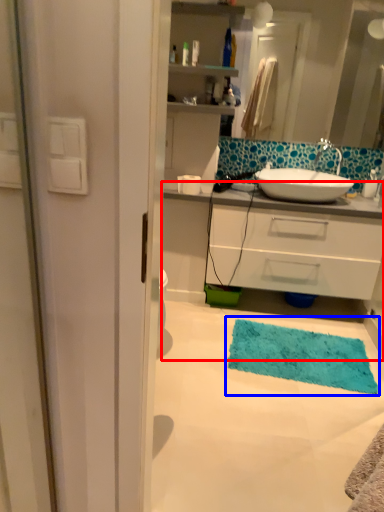
Question: Which object appears closest to the camera in this image, bathroom cabinet (highlighted by a red box) or bath mat (highlighted by a blue box)?

Choices:
 (A) bathroom cabinet
 (B) bath mat

Answer: (B)